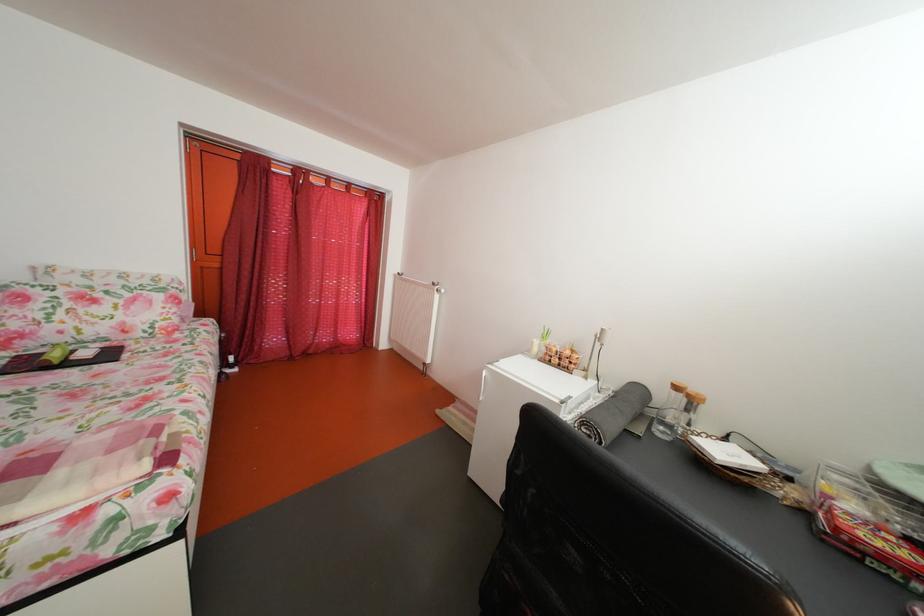
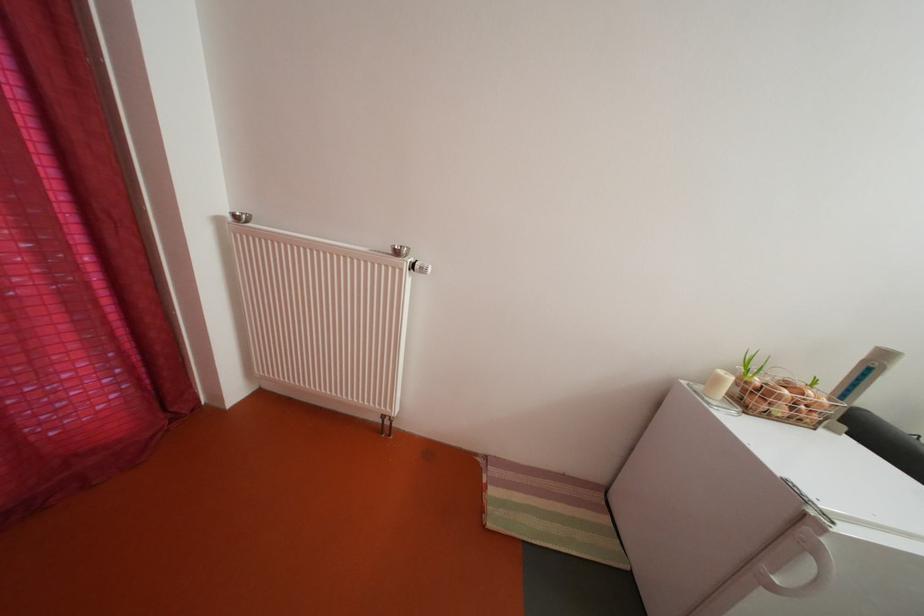
Where in the second image is the point corresponding to point 566,367 from the first image?

(792, 416)